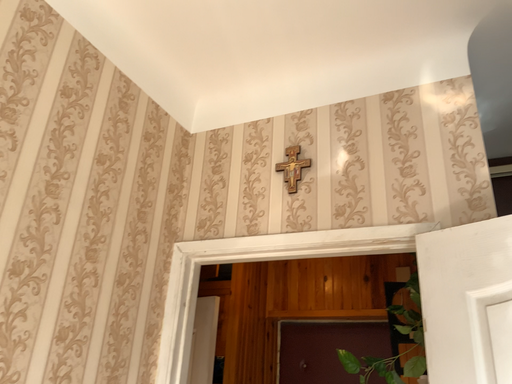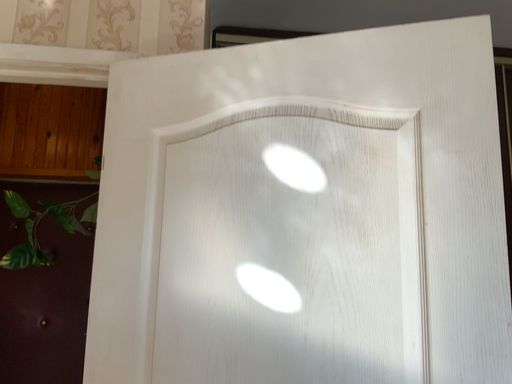
Question: How did the camera likely rotate when shooting the video?

Choices:
 (A) rotated left
 (B) rotated right

Answer: (B)